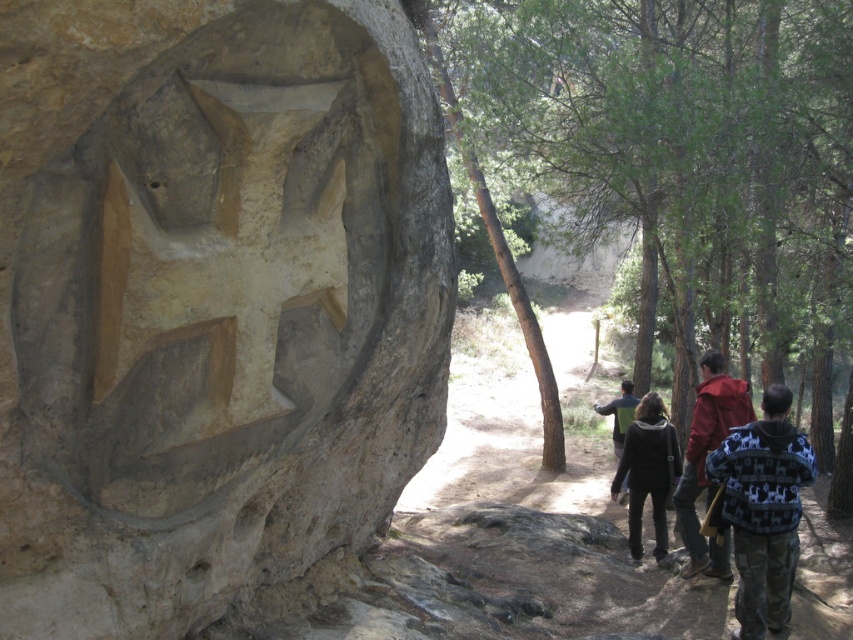
Question: Which point is closer to the camera taking this photo?

Choices:
 (A) (122, 593)
 (B) (473, 186)

Answer: (A)

Question: Which of the following is the farthest from the observer?

Choices:
 (A) (618, 426)
 (B) (154, 72)

Answer: (A)

Question: From the image, what is the correct spatial relationship of knitted sweater at right in relation to red fleece jacket at right?

Choices:
 (A) left
 (B) right

Answer: (A)

Question: Can you confirm if natural stone carving at center is positioned to the left of red fleece jacket at right?

Choices:
 (A) yes
 (B) no

Answer: (A)

Question: Based on their relative distances, which object is farther from the red fleece jacket at right?

Choices:
 (A) brown rough bark tree at center
 (B) natural stone carving at center
 (C) dark blue sweater at center

Answer: (C)

Question: Does knitted sweater at right appear on the left side of brown rough bark tree at center?

Choices:
 (A) yes
 (B) no

Answer: (B)